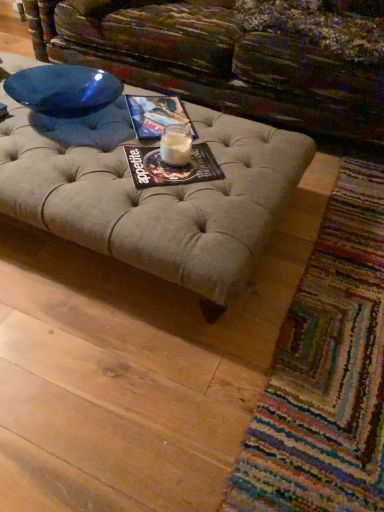
What is the approximate height of multicolored woven mat at lower right?

multicolored woven mat at lower right is 1.91 inches tall.

In order to face multicolored woven mat at lower right, should I rotate leftwards or rightwards?

It's best to rotate right around 21.295 degrees.

In order to click on white glass candle at center in this screenshot , I will do `click(176, 145)`.

You are a GUI agent. You are given a task and a screenshot of the screen. Output one action in this format:
    pyautogui.click(x=<x>, y=<y>)
    Task: Click on the matte paper magazine at center, the 1th magazine positioned from the front
    The height and width of the screenshot is (512, 384).
    Given the screenshot: What is the action you would take?
    pyautogui.click(x=171, y=167)

Is multicolored woven mat at lower right closer to camera compared to matte paper magazine at center, positioned as the 1th magazine in top-to-bottom order?

Yes, the depth of multicolored woven mat at lower right is less than that of matte paper magazine at center, positioned as the 1th magazine in top-to-bottom order.

Which of these two, multicolored woven mat at lower right or matte paper magazine at center, positioned as the 1th magazine in top-to-bottom order, is thinner?

matte paper magazine at center, positioned as the 1th magazine in top-to-bottom order, is thinner.

Find the location of a particular element. The width and height of the screenshot is (384, 512). mat in front of the matte paper magazine at center, positioned as the second magazine in front-to-back order is located at coordinates [x=326, y=371].

Is the position of matte paper magazine at center, the first magazine from the back, less distant than that of multicolored woven mat at lower right?

That is False.

Which of these two, matte paper magazine at center, positioned as the second magazine in front-to-back order, or multicolored woven mat at lower right, stands taller?

multicolored woven mat at lower right is taller.

Would you say matte paper magazine at center, the first magazine from the back, is outside multicolored woven mat at lower right?

matte paper magazine at center, the first magazine from the back, lies outside multicolored woven mat at lower right's area.

Is the surface of white glass candle at center in direct contact with matte paper magazine at center, positioned as the second magazine in front-to-back order?

No, white glass candle at center is not with matte paper magazine at center, positioned as the second magazine in front-to-back order.

Is white glass candle at center turned away from matte paper magazine at center, the 2th magazine in the bottom-to-top sequence?

No, white glass candle at center's orientation is not away from matte paper magazine at center, the 2th magazine in the bottom-to-top sequence.

Is white glass candle at center situated inside matte paper magazine at center, the 2th magazine in the bottom-to-top sequence, or outside?

white glass candle at center is not inside matte paper magazine at center, the 2th magazine in the bottom-to-top sequence, it's outside.

Between white glass candle at center and matte paper magazine at center, positioned as the second magazine in front-to-back order, which one appears on the left side from the viewer's perspective?

Positioned to the left is matte paper magazine at center, positioned as the second magazine in front-to-back order.

From a real-world perspective, which object rests below the other?

In real-world perspective, multicolored woven mat at lower right is lower.

Who is taller, matte paper magazine at center, the 1th magazine positioned from the front, or multicolored woven mat at lower right?

With more height is multicolored woven mat at lower right.

In the image, is matte paper magazine at center, the 2th magazine when ordered from top to bottom, on the left side or the right side of multicolored woven mat at lower right?

From the image, it's evident that matte paper magazine at center, the 2th magazine when ordered from top to bottom, is to the left of multicolored woven mat at lower right.

From the image's perspective, relative to multicolored woven mat at lower right, is matte paper magazine at center, the 2th magazine when ordered from top to bottom, above or below?

matte paper magazine at center, the 2th magazine when ordered from top to bottom, is situated higher than multicolored woven mat at lower right in the image.

Considering the relative sizes of matte paper magazine at center, the 1th magazine positioned from the front, and matte paper magazine at center, the 2th magazine in the bottom-to-top sequence, in the image provided, is matte paper magazine at center, the 1th magazine positioned from the front, shorter than matte paper magazine at center, the 2th magazine in the bottom-to-top sequence,?

Yes, matte paper magazine at center, the 1th magazine positioned from the front, is shorter than matte paper magazine at center, the 2th magazine in the bottom-to-top sequence.

Is matte paper magazine at center, which ranks as the first magazine in bottom-to-top order, not near matte paper magazine at center, positioned as the second magazine in front-to-back order?

matte paper magazine at center, which ranks as the first magazine in bottom-to-top order, is near matte paper magazine at center, positioned as the second magazine in front-to-back order, not far away.

Where is `magazine beneath the matte paper magazine at center, the 2th magazine in the bottom-to-top sequence (from a real-world perspective)`? Image resolution: width=384 pixels, height=512 pixels. magazine beneath the matte paper magazine at center, the 2th magazine in the bottom-to-top sequence (from a real-world perspective) is located at coordinates (171, 167).

From a real-world perspective, which is physically above, matte paper magazine at center, the 1th magazine positioned from the front, or matte paper magazine at center, the 2th magazine in the bottom-to-top sequence?

In real-world perspective, matte paper magazine at center, the 2th magazine in the bottom-to-top sequence, is above.

Can you confirm if matte paper magazine at center, the first magazine from the back, is positioned to the left of white glass candle at center?

Indeed, matte paper magazine at center, the first magazine from the back, is positioned on the left side of white glass candle at center.

From a real-world perspective, is matte paper magazine at center, positioned as the second magazine in front-to-back order, under white glass candle at center?

Indeed, from a real-world perspective, matte paper magazine at center, positioned as the second magazine in front-to-back order, is positioned beneath white glass candle at center.

From the image's perspective, is matte paper magazine at center, the first magazine from the back, located above white glass candle at center?

Yes, from the image's perspective, matte paper magazine at center, the first magazine from the back, is on top of white glass candle at center.

Is matte paper magazine at center, positioned as the 1th magazine in top-to-bottom order, spatially inside white glass candle at center, or outside of it?

matte paper magazine at center, positioned as the 1th magazine in top-to-bottom order, cannot be found inside white glass candle at center.

Is matte paper magazine at center, the first magazine from the back, touching matte paper magazine at center, the 1th magazine positioned from the front?

No, matte paper magazine at center, the first magazine from the back, is not touching matte paper magazine at center, the 1th magazine positioned from the front.

Can you confirm if matte paper magazine at center, positioned as the 1th magazine in top-to-bottom order, is thinner than matte paper magazine at center, arranged as the 2th magazine when viewed from the back?

In fact, matte paper magazine at center, positioned as the 1th magazine in top-to-bottom order, might be wider than matte paper magazine at center, arranged as the 2th magazine when viewed from the back.

From a real-world perspective, which is physically below, matte paper magazine at center, positioned as the 1th magazine in top-to-bottom order, or matte paper magazine at center, arranged as the 2th magazine when viewed from the back?

matte paper magazine at center, arranged as the 2th magazine when viewed from the back, from a real-world perspective.

Locate an element on the screen. mat that appears below the matte paper magazine at center, positioned as the second magazine in front-to-back order (from a real-world perspective) is located at coordinates (326, 371).

Find the location of a particular element. The width and height of the screenshot is (384, 512). mat located on the right of matte paper magazine at center, the 2th magazine in the bottom-to-top sequence is located at coordinates (326, 371).

When comparing their distances from matte paper magazine at center, the 2th magazine when ordered from top to bottom, does matte paper magazine at center, positioned as the second magazine in front-to-back order, or white glass candle at center seem closer?

white glass candle at center is closer to matte paper magazine at center, the 2th magazine when ordered from top to bottom.

Based on their spatial positions, is multicolored woven mat at lower right or matte paper magazine at center, the 2th magazine when ordered from top to bottom, closer to white glass candle at center?

matte paper magazine at center, the 2th magazine when ordered from top to bottom, lies closer to white glass candle at center than the other object.

Which object lies nearer to the anchor point white glass candle at center, multicolored woven mat at lower right or matte paper magazine at center, the 2th magazine in the bottom-to-top sequence?

matte paper magazine at center, the 2th magazine in the bottom-to-top sequence, lies closer to white glass candle at center than the other object.

Estimate the real-world distances between objects in this image. Which object is closer to multicolored woven mat at lower right, matte paper magazine at center, the 2th magazine when ordered from top to bottom, or white glass candle at center?

matte paper magazine at center, the 2th magazine when ordered from top to bottom.

From the picture: Looking at the image, which one is located further to matte paper magazine at center, the 1th magazine positioned from the front, matte paper magazine at center, the 2th magazine in the bottom-to-top sequence, or multicolored woven mat at lower right?

Based on the image, multicolored woven mat at lower right appears to be further to matte paper magazine at center, the 1th magazine positioned from the front.

When comparing their distances from matte paper magazine at center, positioned as the 1th magazine in top-to-bottom order, does white glass candle at center or matte paper magazine at center, the 1th magazine positioned from the front, seem closer?

Based on the image, white glass candle at center appears to be nearer to matte paper magazine at center, positioned as the 1th magazine in top-to-bottom order.

Based on their spatial positions, is matte paper magazine at center, the first magazine from the back, or multicolored woven mat at lower right closer to white glass candle at center?

Based on the image, matte paper magazine at center, the first magazine from the back, appears to be nearer to white glass candle at center.

When comparing their distances from matte paper magazine at center, which ranks as the first magazine in bottom-to-top order, does multicolored woven mat at lower right or matte paper magazine at center, the first magazine from the back, seem closer?

matte paper magazine at center, the first magazine from the back.

Locate an element on the screen. candle holder between matte paper magazine at center, the first magazine from the back, and matte paper magazine at center, the 2th magazine when ordered from top to bottom, from top to bottom is located at coordinates (176, 145).

Find the location of a particular element. This screenshot has height=512, width=384. candle holder between matte paper magazine at center, the first magazine from the back, and multicolored woven mat at lower right, in the horizontal direction is located at coordinates (176, 145).

This screenshot has width=384, height=512. What are the coordinates of `candle holder between matte paper magazine at center, the 1th magazine positioned from the front, and multicolored woven mat at lower right` in the screenshot? It's located at (176, 145).

Find the location of a particular element. This screenshot has height=512, width=384. magazine located between matte paper magazine at center, the first magazine from the back, and multicolored woven mat at lower right in the left-right direction is located at coordinates (171, 167).